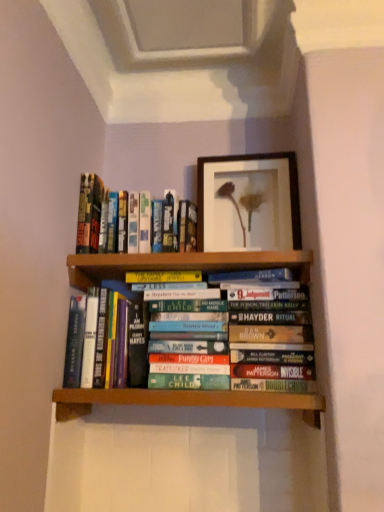
Question: From a real-world perspective, is hardcover book at center, the first book when ordered from bottom to top, beneath hardcover books at upper left, the 1th book viewed from the top?

Choices:
 (A) yes
 (B) no

Answer: (A)

Question: Would you say hardcover book at center, positioned as the 2th book in top-to-bottom order, contains hardcover books at upper left, the second book positioned from the bottom?

Choices:
 (A) yes
 (B) no

Answer: (B)

Question: From the image's perspective, would you say hardcover book at center, the first book when ordered from bottom to top, is positioned over hardcover books at upper left, the second book positioned from the bottom?

Choices:
 (A) no
 (B) yes

Answer: (A)

Question: Is hardcover book at center, the first book when ordered from bottom to top, aimed at hardcover books at upper left, the 1th book viewed from the top?

Choices:
 (A) yes
 (B) no

Answer: (B)

Question: Does hardcover book at center, the first book when ordered from bottom to top, appear on the left side of hardcover books at upper left, the second book positioned from the bottom?

Choices:
 (A) no
 (B) yes

Answer: (B)

Question: Does hardcover book at center, positioned as the 2th book in top-to-bottom order, have a greater width compared to hardcover books at upper left, the 1th book viewed from the top?

Choices:
 (A) yes
 (B) no

Answer: (A)

Question: Is hardcover books at upper left, the second book positioned from the bottom, looking in the opposite direction of hardcover book at center, positioned as the 2th book in top-to-bottom order?

Choices:
 (A) yes
 (B) no

Answer: (B)

Question: Does hardcover books at upper left, the 1th book viewed from the top, have a greater height compared to hardcover book at center, the first book when ordered from bottom to top?

Choices:
 (A) no
 (B) yes

Answer: (A)

Question: From the image's perspective, does hardcover books at upper left, the second book positioned from the bottom, appear lower than hardcover book at center, positioned as the 2th book in top-to-bottom order?

Choices:
 (A) no
 (B) yes

Answer: (A)

Question: Does hardcover books at upper left, the 1th book viewed from the top, have a smaller size compared to hardcover book at center, the first book when ordered from bottom to top?

Choices:
 (A) yes
 (B) no

Answer: (B)

Question: Can you confirm if hardcover books at upper left, the second book positioned from the bottom, is thinner than hardcover book at center, the first book when ordered from bottom to top?

Choices:
 (A) no
 (B) yes

Answer: (B)

Question: Would you say hardcover books at upper left, the 1th book viewed from the top, is outside hardcover book at center, positioned as the 2th book in top-to-bottom order?

Choices:
 (A) no
 (B) yes

Answer: (B)

Question: From a real-world perspective, does wooden framed picture at upper center stand above hardcover book at center, positioned as the 2th book in top-to-bottom order?

Choices:
 (A) no
 (B) yes

Answer: (B)